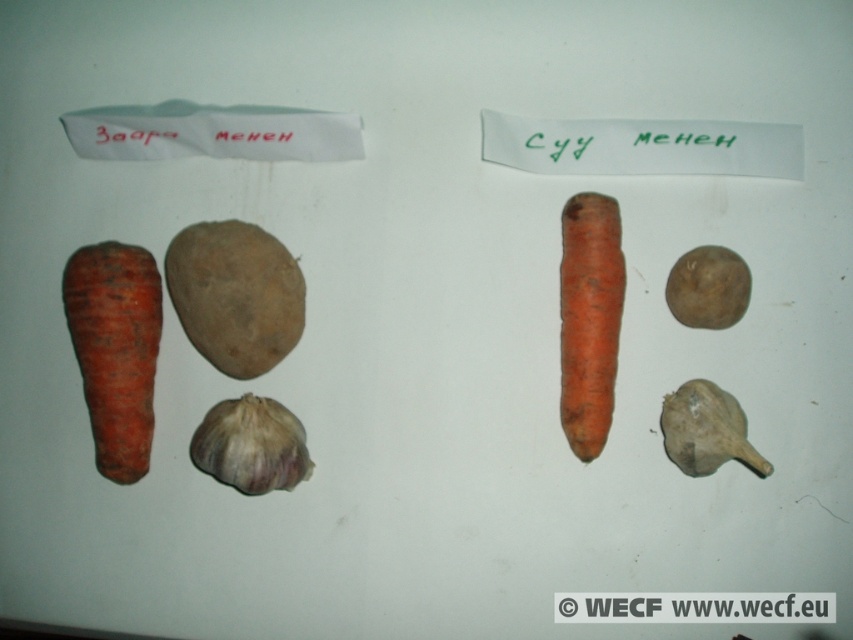
Question: Considering the relative positions of orange rough carrot at center and grayish matte garlic at lower right in the image provided, where is orange rough carrot at center located with respect to grayish matte garlic at lower right?

Choices:
 (A) above
 (B) below

Answer: (A)

Question: Which of the following is the farthest from the observer?

Choices:
 (A) orange rough carrot at left
 (B) purple papery garlic at lower center
 (C) brown rough potato at center
 (D) brown matte potato at center right

Answer: (C)

Question: Which object is the farthest from the orange rough carrot at center?

Choices:
 (A) brown matte potato at center right
 (B) brown rough potato at center

Answer: (B)

Question: Does orange rough carrot at left appear over purple papery garlic at lower center?

Choices:
 (A) no
 (B) yes

Answer: (B)

Question: Is purple papery garlic at lower center bigger than grayish matte garlic at lower right?

Choices:
 (A) yes
 (B) no

Answer: (A)

Question: Estimate the real-world distances between objects in this image. Which object is farther from the orange rough carrot at left?

Choices:
 (A) brown matte potato at center right
 (B) brown rough potato at center
 (C) grayish matte garlic at lower right
 (D) purple papery garlic at lower center

Answer: (A)